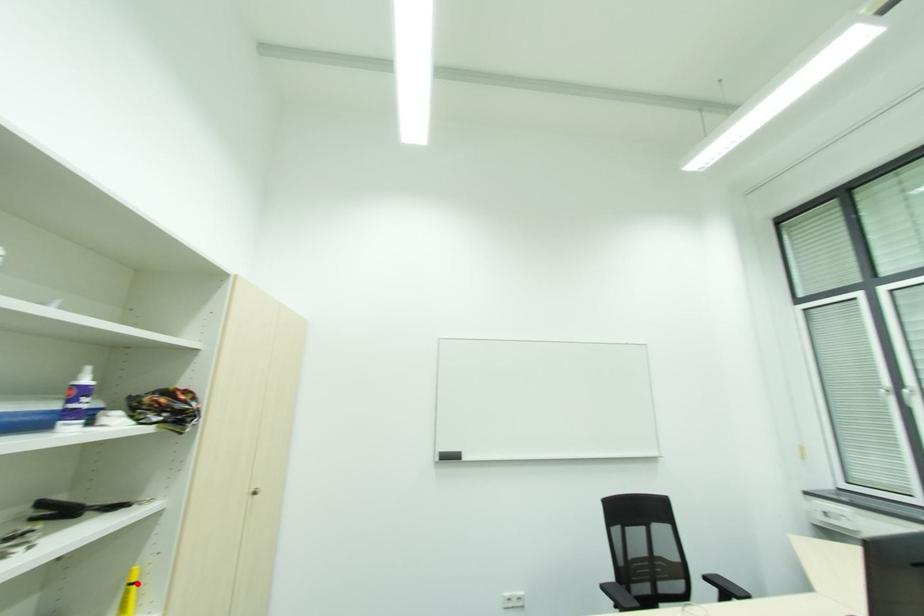
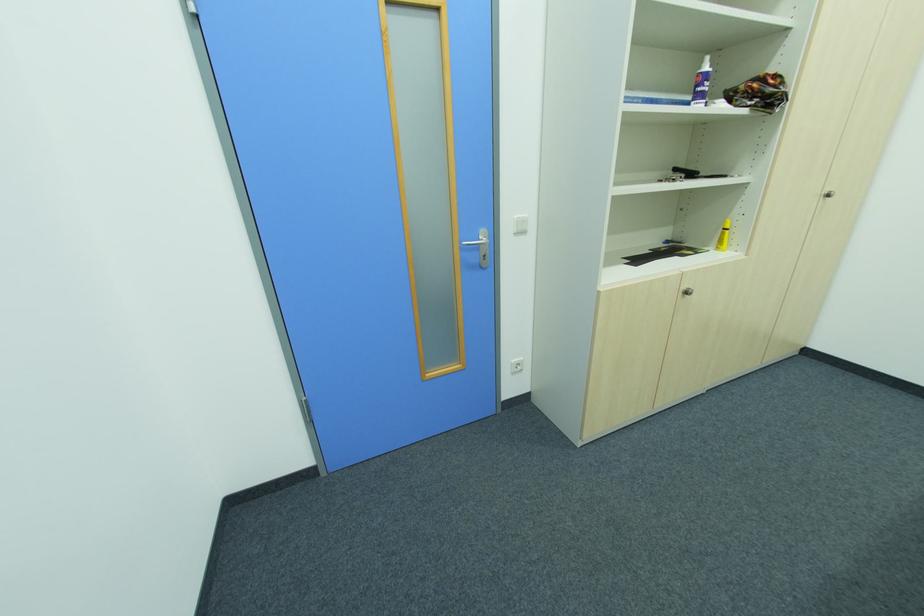
The point at the highlighted location is marked in the first image. Where is the corresponding point in the second image?

(728, 230)